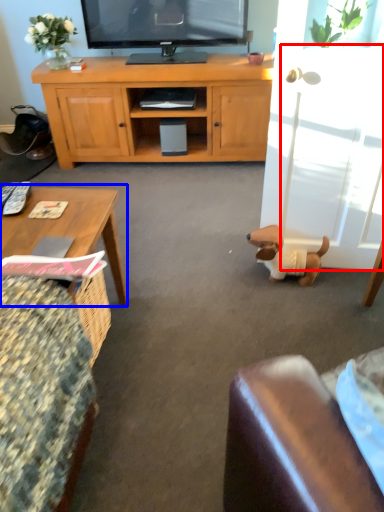
Question: Which object is further to the camera taking this photo, glass door (highlighted by a red box) or coffee table (highlighted by a blue box)?

Choices:
 (A) glass door
 (B) coffee table

Answer: (A)